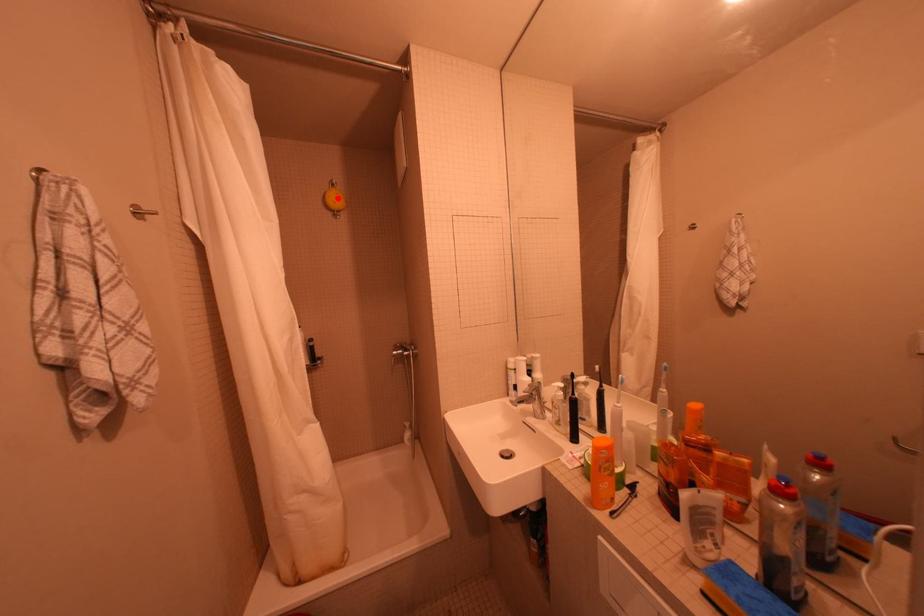
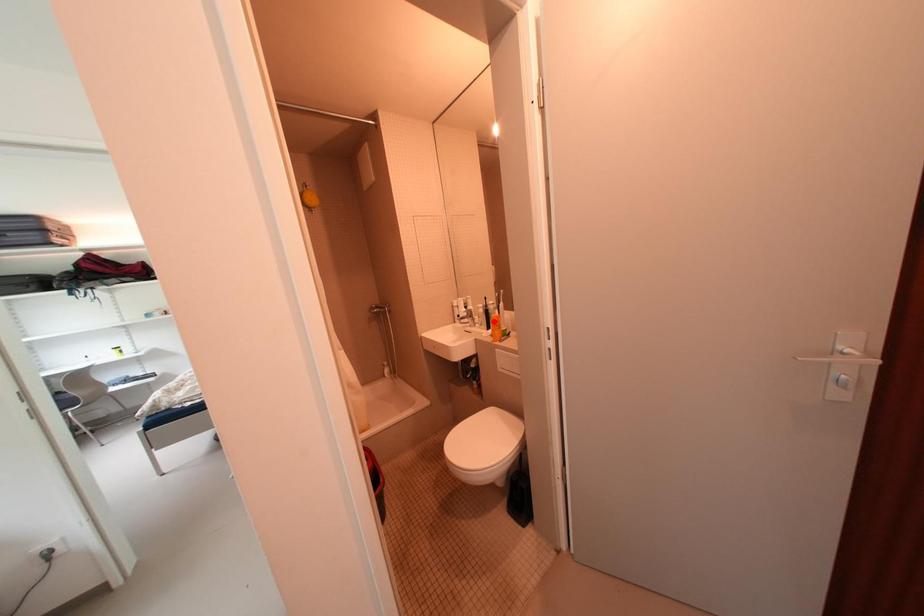
I am providing you with two images of the same scene from different viewpoints. A red point is marked on the first image and another point is marked on the second image. Is the red point in image1 aligned with the point shown in image2?

No